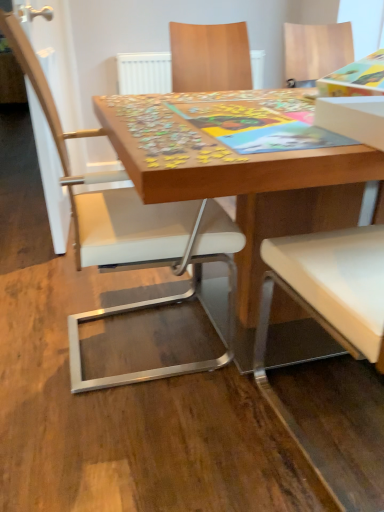
Image resolution: width=384 pixels, height=512 pixels. What are the coordinates of `vacant space situated on the left part of white leather chair at center` in the screenshot? It's located at (38, 323).